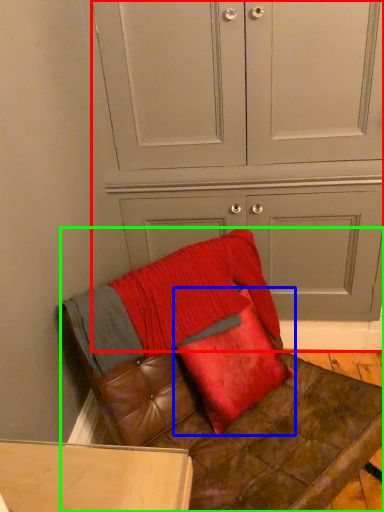
Question: Which object is the closest to the dresser (highlighted by a red box)? Choose among these: pillow (highlighted by a blue box) or furniture (highlighted by a green box).

Choices:
 (A) pillow
 (B) furniture

Answer: (A)